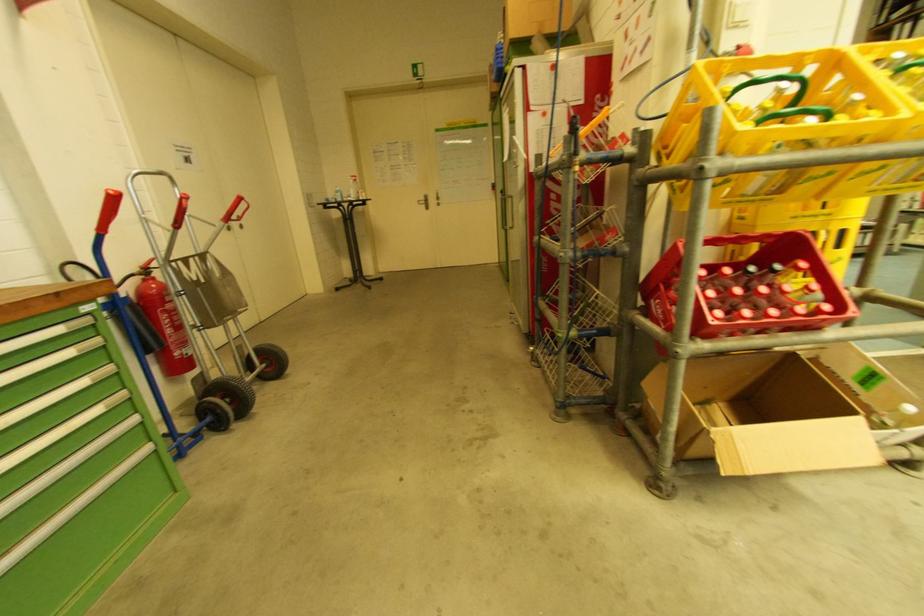
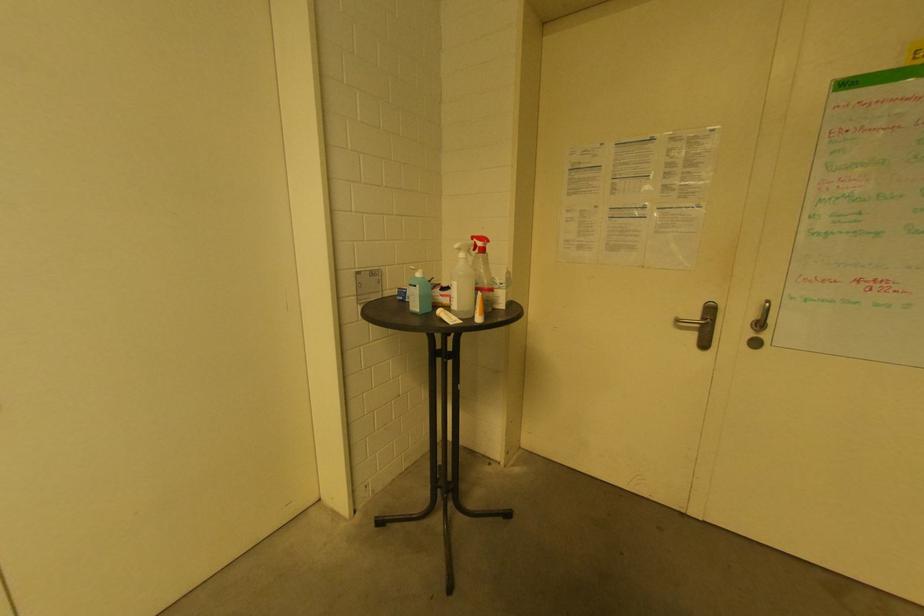
In the second image, find the point that corresponds to point (440, 200) in the first image.

(761, 326)